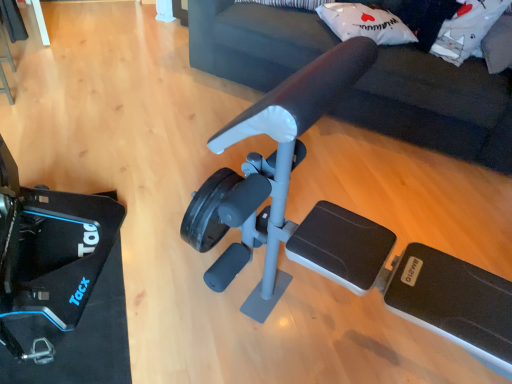
Question: From the image's perspective, is matte black exercise machine at center beneath white soft pillow at upper right, which is the second pillow from left to right?

Choices:
 (A) yes
 (B) no

Answer: (B)

Question: From a real-world perspective, is matte black exercise machine at center below white soft pillow at upper right, which is the first pillow in right-to-left order?

Choices:
 (A) no
 (B) yes

Answer: (B)

Question: Is there a large distance between matte black exercise machine at center and white soft pillow at upper right, which is the first pillow in right-to-left order?

Choices:
 (A) no
 (B) yes

Answer: (A)

Question: Can you confirm if matte black exercise machine at center is bigger than white soft pillow at upper right, which is the second pillow from left to right?

Choices:
 (A) no
 (B) yes

Answer: (B)

Question: Is matte black exercise machine at center taller than white soft pillow at upper right, which is the first pillow in right-to-left order?

Choices:
 (A) no
 (B) yes

Answer: (B)

Question: In terms of height, does matte black exercise machine at center look taller or shorter compared to white soft pillow at upper right, which is the first pillow in right-to-left order?

Choices:
 (A) short
 (B) tall

Answer: (B)

Question: Considering the relative positions of matte black exercise machine at center and white soft pillow at upper right, which is the first pillow in right-to-left order, in the image provided, is matte black exercise machine at center to the left or to the right of white soft pillow at upper right, which is the first pillow in right-to-left order,?

Choices:
 (A) right
 (B) left

Answer: (B)

Question: Is matte black exercise machine at center in front of or behind white soft pillow at upper right, which is the first pillow in right-to-left order, in the image?

Choices:
 (A) front
 (B) behind

Answer: (A)

Question: Is matte black exercise machine at center wider or thinner than white soft pillow at upper right, which is the first pillow in right-to-left order?

Choices:
 (A) thin
 (B) wide

Answer: (B)

Question: In terms of size, does white matte pillow at upper center, positioned as the first pillow in left-to-right order, appear bigger or smaller than white soft pillow at upper right, which is the first pillow in right-to-left order?

Choices:
 (A) small
 (B) big

Answer: (A)

Question: Is white matte pillow at upper center, the 2th pillow in the right-to-left sequence, taller or shorter than white soft pillow at upper right, which is the second pillow from left to right?

Choices:
 (A) tall
 (B) short

Answer: (B)

Question: Relative to white soft pillow at upper right, which is the first pillow in right-to-left order, is white matte pillow at upper center, the 2th pillow in the right-to-left sequence, in front or behind?

Choices:
 (A) behind
 (B) front

Answer: (A)

Question: Would you say white matte pillow at upper center, positioned as the first pillow in left-to-right order, is inside or outside white soft pillow at upper right, which is the second pillow from left to right?

Choices:
 (A) inside
 (B) outside

Answer: (B)

Question: In terms of width, does matte black exercise machine at center look wider or thinner when compared to white matte pillow at upper center, the 2th pillow in the right-to-left sequence?

Choices:
 (A) wide
 (B) thin

Answer: (A)

Question: In terms of height, does matte black exercise machine at center look taller or shorter compared to white matte pillow at upper center, the 2th pillow in the right-to-left sequence?

Choices:
 (A) tall
 (B) short

Answer: (A)